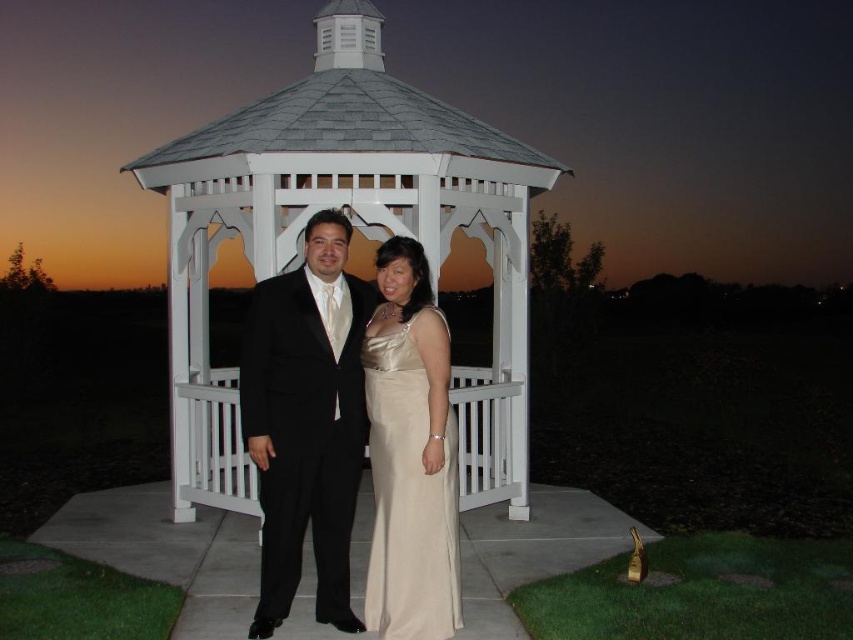
Is white wooden gazebo at center closer to camera compared to satin dress at center?

No, white wooden gazebo at center is further to the viewer.

Looking at this image, which of these two, white wooden gazebo at center or satin dress at center, stands taller?

white wooden gazebo at center

What do you see at coordinates (354, 227) in the screenshot? I see `white wooden gazebo at center` at bounding box center [354, 227].

I want to click on white wooden gazebo at center, so click(x=354, y=227).

How much distance is there between black satin suit at center and satin dress at center?

black satin suit at center and satin dress at center are 35.86 centimeters apart.

Is black satin suit at center positioned at the back of satin dress at center?

That is True.

In order to click on black satin suit at center in this screenshot , I will do `click(306, 420)`.

Find the location of `black satin suit at center`. black satin suit at center is located at coordinates (306, 420).

Is white wooden gazebo at center further to the viewer compared to black satin suit at center?

Yes, it is behind black satin suit at center.

Is white wooden gazebo at center wider than black satin suit at center?

Yes, white wooden gazebo at center is wider than black satin suit at center.

Is point (210, 220) more distant than point (335, 326)?

Yes, it is behind point (335, 326).

Where is `white wooden gazebo at center`? white wooden gazebo at center is located at coordinates pos(354,227).